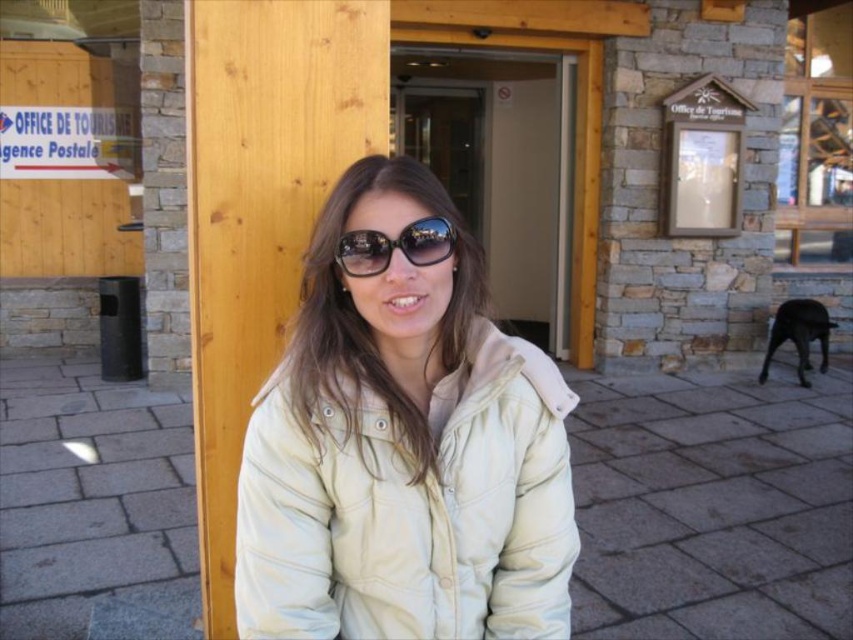
Who is lower down, white matte jacket at center or black reflective sunglasses at center?

Positioned lower is white matte jacket at center.

Who is positioned more to the right, white matte jacket at center or black reflective sunglasses at center?

Positioned to the right is white matte jacket at center.

Is point (321, 580) farther from viewer compared to point (354, 273)?

Yes.

Where is `white matte jacket at center`? This screenshot has width=853, height=640. white matte jacket at center is located at coordinates (403, 449).